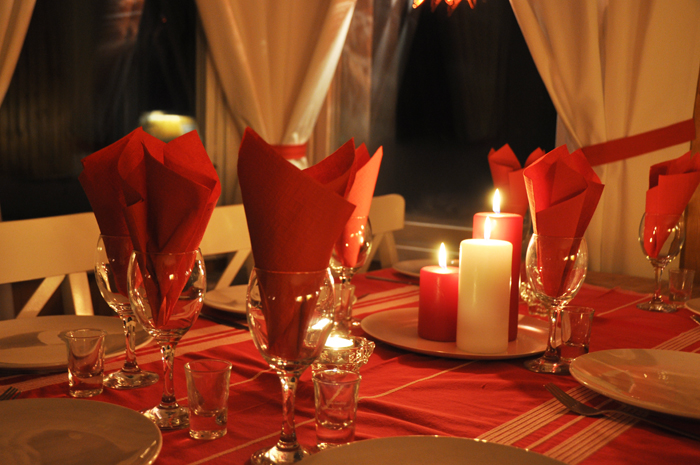
Where is `wine glasses`? wine glasses is located at coordinates (108, 261), (164, 287), (276, 309), (368, 252), (554, 262), (666, 240).